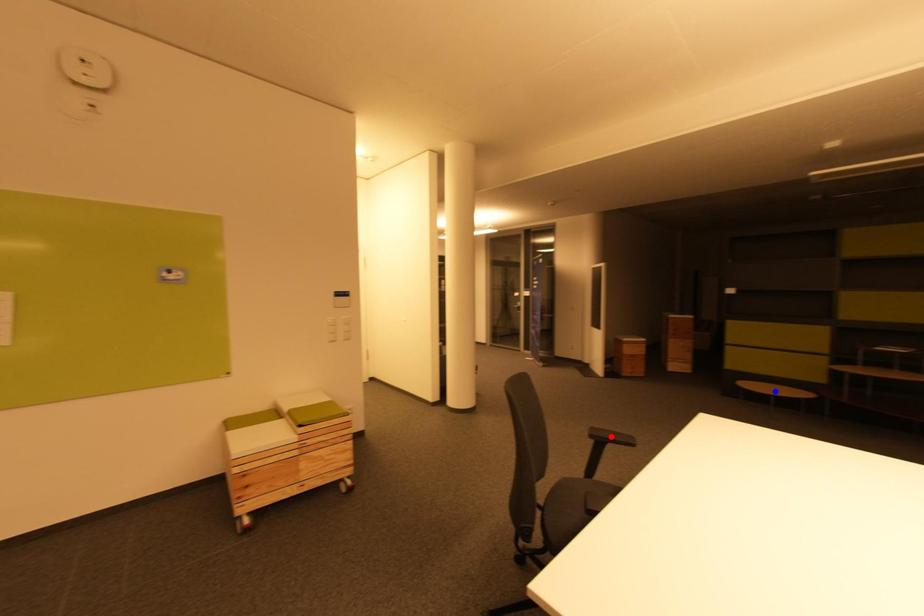
Question: Two points are marked on the image. Which point is closer to the camera?

Choices:
 (A) Blue point is closer.
 (B) Red point is closer.

Answer: (B)